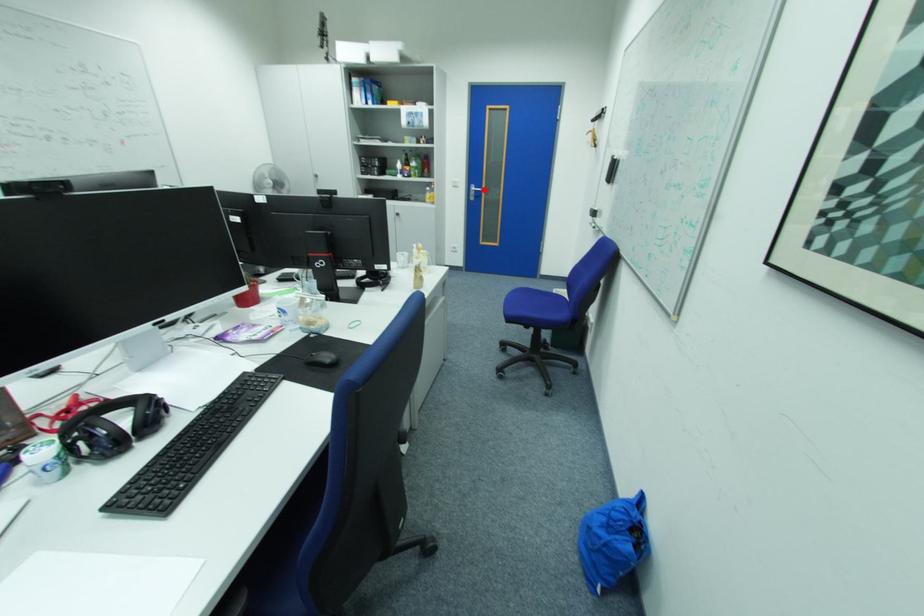
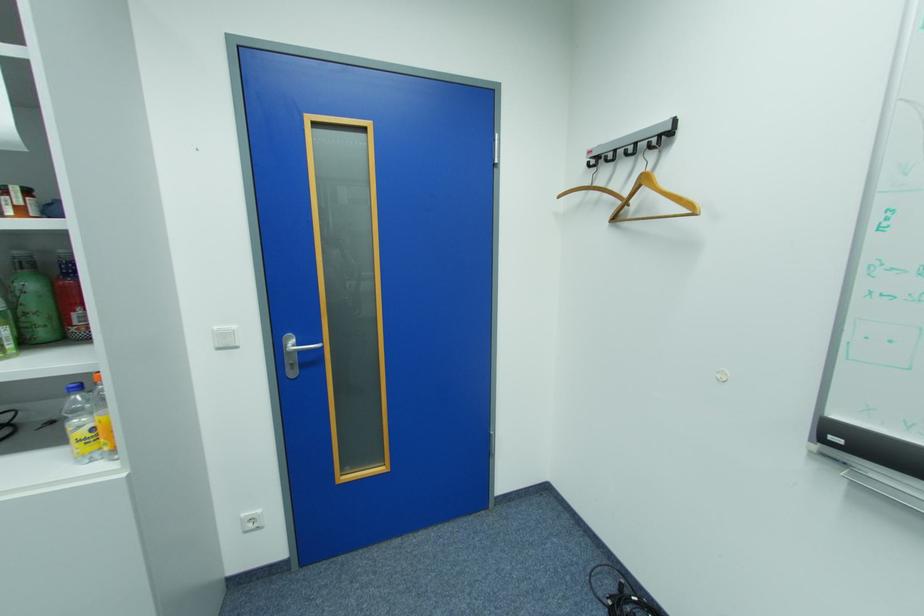
The point at the highlighted location is marked in the first image. Where is the corresponding point in the second image?

(307, 344)